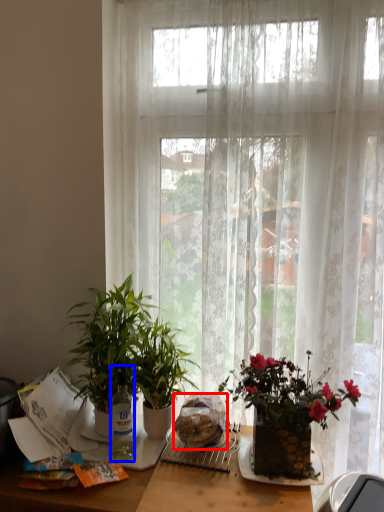
Question: Which object is further to the camera taking this photo, food (highlighted by a red box) or bottle (highlighted by a blue box)?

Choices:
 (A) food
 (B) bottle

Answer: (B)